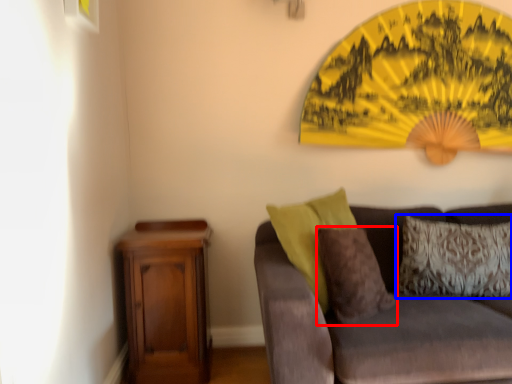
Question: Which object appears closest to the camera in this image, pillow (highlighted by a red box) or pillow (highlighted by a blue box)?

Choices:
 (A) pillow
 (B) pillow

Answer: (A)